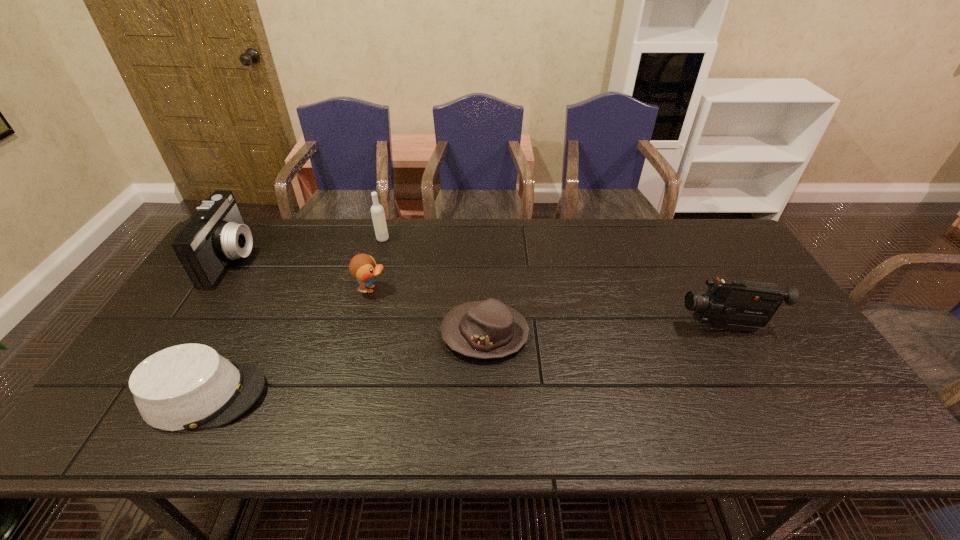
Identify the location of object that is the second closest one to the rightmost object. The height and width of the screenshot is (540, 960). (362, 267).

Find the location of a particular element. Image resolution: width=960 pixels, height=540 pixels. object that stands as the third closest to the farther camcorder is located at coordinates (377, 211).

Where is `vacant region that satisfies the following two spatial constraints: 1. on the front side of the vodka; 2. on the front-facing side of the left hat`? This screenshot has height=540, width=960. vacant region that satisfies the following two spatial constraints: 1. on the front side of the vodka; 2. on the front-facing side of the left hat is located at coordinates (341, 395).